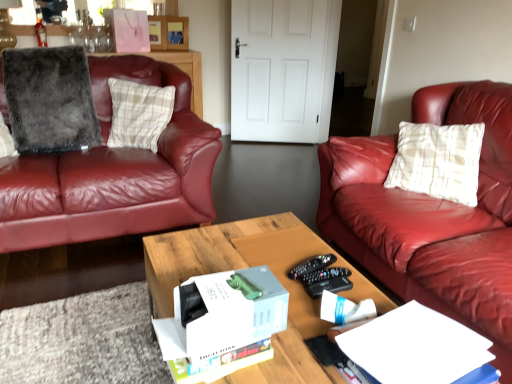
Locate an element on the screen. The height and width of the screenshot is (384, 512). vacant area on top of white paper at lower right (from a real-world perspective) is located at coordinates (415, 347).